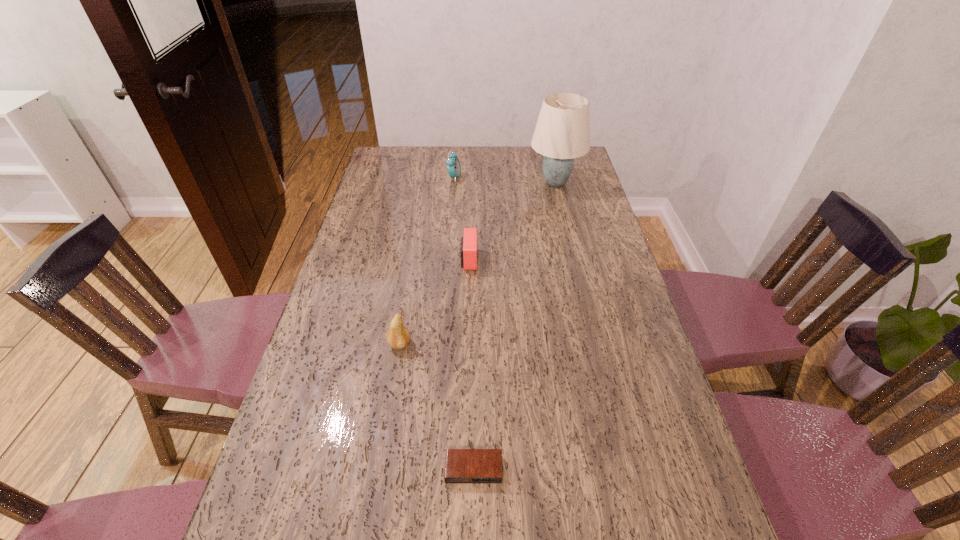
Find the location of a particular element. The image size is (960, 540). free spot located on the front of the tallest object is located at coordinates (575, 266).

This screenshot has width=960, height=540. In order to click on blank space located on the face of the tallest alarm clock in this screenshot , I will do `click(530, 178)`.

The image size is (960, 540). I want to click on vacant space situated on the right of the second nearest object, so click(x=523, y=344).

Where is `free space located on the front-facing side of the second shortest object`? The image size is (960, 540). free space located on the front-facing side of the second shortest object is located at coordinates (512, 260).

Find the location of a particular element. vacant region located on the front face of the nearest alarm clock is located at coordinates (473, 526).

Identify the location of lampshade that is at the far edge. (562, 133).

Where is `alarm clock that is at the far edge`? The height and width of the screenshot is (540, 960). alarm clock that is at the far edge is located at coordinates (453, 165).

Where is `object present at the right edge`? object present at the right edge is located at coordinates (562, 133).

You are a GUI agent. You are given a task and a screenshot of the screen. Output one action in this format:
    pyautogui.click(x=<x>, y=<y>)
    Task: Click on the object present at the far right corner
    Image resolution: width=960 pixels, height=540 pixels.
    Given the screenshot: What is the action you would take?
    pyautogui.click(x=562, y=133)

In the image, there is a desktop. In order to click on vacant space at the far edge in this screenshot , I will do `click(418, 170)`.